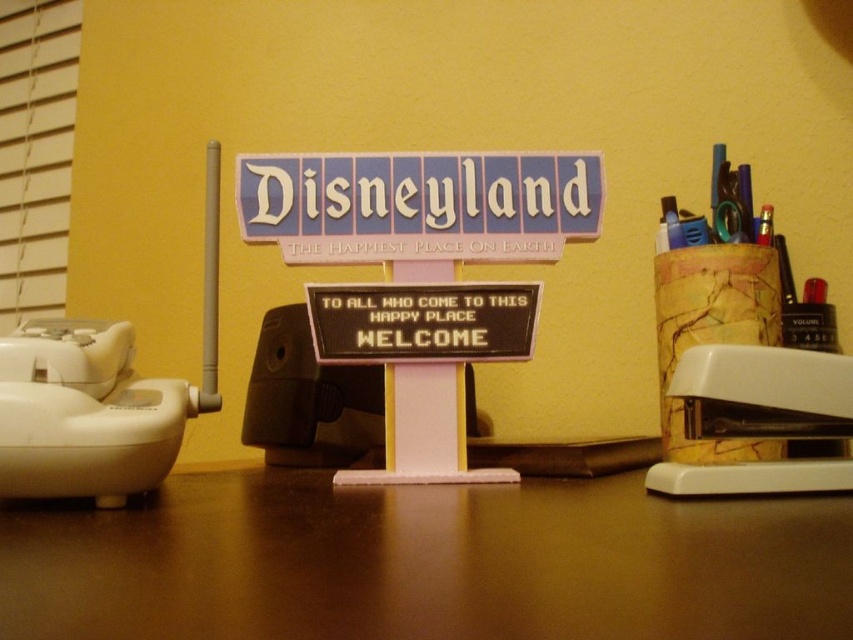
Question: Is white plastic stapler at right bigger than black plastic sign at center?

Choices:
 (A) yes
 (B) no

Answer: (A)

Question: Which object is the closest to the white plastic stapler at right?

Choices:
 (A) black plastic sign at center
 (B) white plastic stapler at lower left

Answer: (A)

Question: Which point appears farthest from the camera in this image?

Choices:
 (A) (685, 460)
 (B) (360, 628)
 (C) (292, 164)
 (D) (407, 310)

Answer: (C)

Question: Is brown matte table at center wider than white plastic stapler at lower left?

Choices:
 (A) yes
 (B) no

Answer: (A)

Question: Which point is closer to the camera?

Choices:
 (A) matte plastic disneyland sign at center
 (B) metallic gold pen at right
 (C) black plastic sign at center

Answer: (C)

Question: Is matte plastic disneyland sign at center wider than metallic gold pen at right?

Choices:
 (A) yes
 (B) no

Answer: (A)